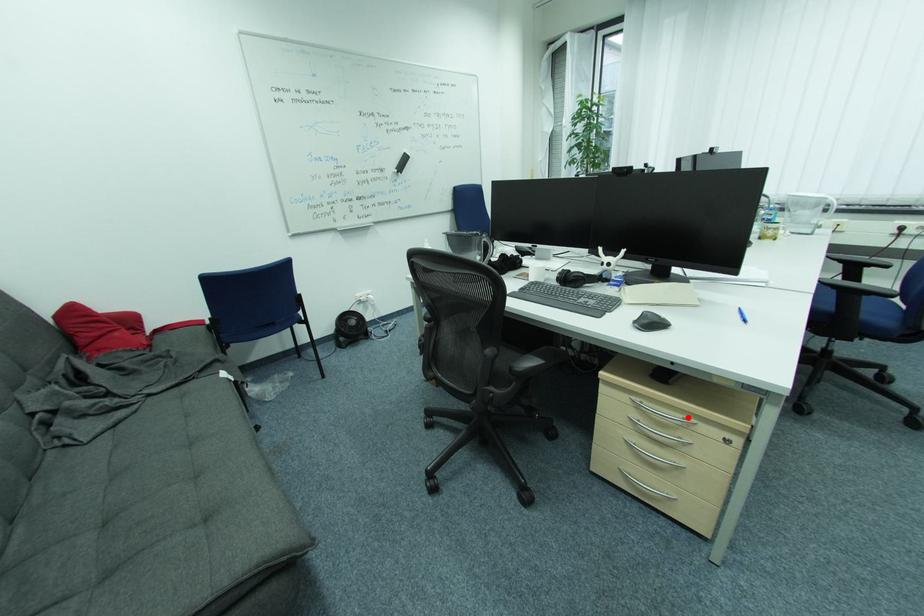
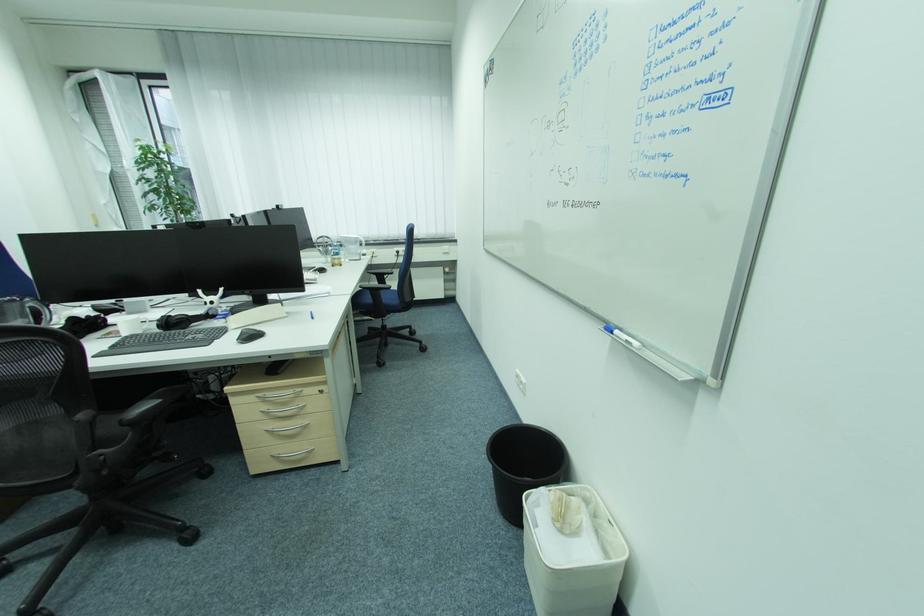
Question: I am providing you with two images of the same scene from different viewpoints. Image1 has a red point marked. In image2, the corresponding 3D location appears at what relative position? Reply with the corresponding letter.

Choices:
 (A) Closer
 (B) Farther

Answer: (B)